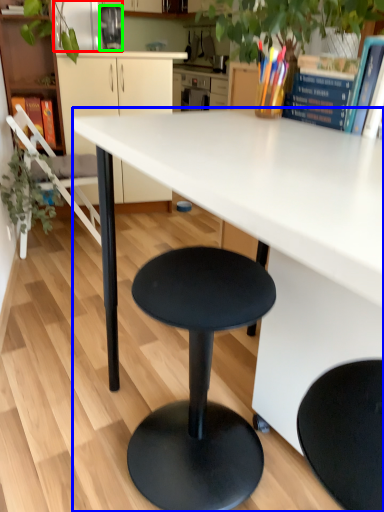
Question: Based on their relative distances, which object is farther from appliance (highlighted by a red box)? Choose from desk (highlighted by a blue box) and appliance (highlighted by a green box).

Choices:
 (A) desk
 (B) appliance

Answer: (A)